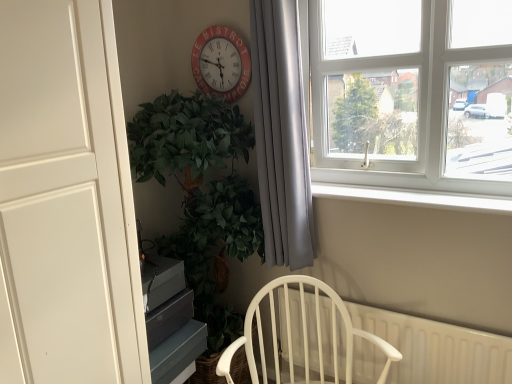
What do you see at coordinates (221, 63) in the screenshot? The image size is (512, 384). I see `matte red clock at upper center` at bounding box center [221, 63].

What do you see at coordinates (303, 336) in the screenshot? The height and width of the screenshot is (384, 512). I see `white wood chair at lower center` at bounding box center [303, 336].

The width and height of the screenshot is (512, 384). I want to click on green leafy plant at left, so click(x=202, y=197).

Find the location of a particular element. silky gray curtain at center is located at coordinates (x=281, y=135).

Where is `matte red clock at upper center`? matte red clock at upper center is located at coordinates (221, 63).

Between point (221, 220) and point (331, 195), which one is positioned behind?

The point (331, 195) is behind.

Is green leafy plant at left inside or outside of white smooth window sill at upper right?

green leafy plant at left is located beyond the bounds of white smooth window sill at upper right.

Is green leafy plant at left positioned with its back to white smooth window sill at upper right?

No, green leafy plant at left's orientation is not away from white smooth window sill at upper right.

Does green leafy plant at left have a greater height compared to white smooth window sill at upper right?

Yes, green leafy plant at left is taller than white smooth window sill at upper right.

Would you say white plastic window at upper right is inside or outside green leafy plant at left?

white plastic window at upper right exists outside the volume of green leafy plant at left.

Considering the positions of objects white plastic window at upper right and green leafy plant at left in the image provided, who is behind, white plastic window at upper right or green leafy plant at left?

green leafy plant at left.

Considering the relative positions of white plastic window at upper right and green leafy plant at left in the image provided, is white plastic window at upper right to the left or to the right of green leafy plant at left?

white plastic window at upper right is to the right of green leafy plant at left.

From the image's perspective, is white plastic window at upper right located beneath green leafy plant at left?

No.

Does matte red clock at upper center lie in front of white plastic radiator at lower right?

No, the depth of matte red clock at upper center is greater than that of white plastic radiator at lower right.

From the image's perspective, would you say matte red clock at upper center is positioned over white plastic radiator at lower right?

Yes, from the image's perspective, matte red clock at upper center is over white plastic radiator at lower right.

Who is smaller, matte red clock at upper center or white plastic radiator at lower right?

matte red clock at upper center is smaller.

Which is in front, point (229, 72) or point (495, 368)?

The point (495, 368) is closer.

Is point (50, 304) positioned in front of point (258, 126)?

Yes, it is in front of point (258, 126).

Can you confirm if white matte door at left is positioned to the left of silky gray curtain at center?

Correct, you'll find white matte door at left to the left of silky gray curtain at center.

From the image's perspective, relative to silky gray curtain at center, is white matte door at left above or below?

From the image's perspective, white matte door at left appears below silky gray curtain at center.

Considering the relative sizes of silky gray curtain at center and white matte door at left in the image provided, is silky gray curtain at center thinner than white matte door at left?

Indeed, silky gray curtain at center has a lesser width compared to white matte door at left.

Does silky gray curtain at center lie in front of white matte door at left?

No, it is not.

From a real-world perspective, which is physically below, silky gray curtain at center or white matte door at left?

white matte door at left is physically lower.

Is silky gray curtain at center far from white matte door at left?

Actually, silky gray curtain at center and white matte door at left are a little close together.

The height and width of the screenshot is (384, 512). I want to click on chair that appears in front of the white plastic window at upper right, so click(x=303, y=336).

Which object is wider, white plastic window at upper right or white wood chair at lower center?

white wood chair at lower center.

Considering the sizes of objects white plastic window at upper right and white wood chair at lower center in the image provided, who is shorter, white plastic window at upper right or white wood chair at lower center?

white wood chair at lower center is shorter.

Based on their sizes in the image, would you say white plastic window at upper right is bigger or smaller than white smooth window sill at upper right?

white plastic window at upper right is bigger than white smooth window sill at upper right.

Is point (390, 168) closer to viewer compared to point (317, 194)?

Yes.

Image resolution: width=512 pixels, height=384 pixels. In the image, there is a white smooth window sill at upper right. Find the location of `window above it (from the image's perspective)`. window above it (from the image's perspective) is located at coordinates (418, 111).

Find the location of a particular element. This screenshot has height=384, width=512. window sill that appears above the green leafy plant at left (from a real-world perspective) is located at coordinates (414, 197).

You are a GUI agent. You are given a task and a screenshot of the screen. Output one action in this format:
    pyautogui.click(x=<x>, y=<y>)
    Task: Click on the houseplant that appears below the white plastic window at upper right (from the image's perspective)
    The image size is (512, 384).
    Given the screenshot: What is the action you would take?
    pyautogui.click(x=202, y=197)

Which object lies further to the anchor point white smooth window sill at upper right, white wood chair at lower center or white plastic radiator at lower right?

Among the two, white wood chair at lower center is located further to white smooth window sill at upper right.

Estimate the real-world distances between objects in this image. Which object is further from green leafy plant at left, white plastic radiator at lower right or white plastic window at upper right?

Among the two, white plastic window at upper right is located further to green leafy plant at left.

From the image, which object appears to be farther from silky gray curtain at center, white smooth window sill at upper right or white wood chair at lower center?

white wood chair at lower center.

Estimate the real-world distances between objects in this image. Which object is closer to white smooth window sill at upper right, white plastic window at upper right or silky gray curtain at center?

The object closer to white smooth window sill at upper right is white plastic window at upper right.

From the image, which object appears to be nearer to white plastic radiator at lower right, white plastic window at upper right or white wood chair at lower center?

The object closer to white plastic radiator at lower right is white wood chair at lower center.

Considering their positions, is matte red clock at upper center positioned further to white plastic window at upper right than white matte door at left?

Based on the image, white matte door at left appears to be further to white plastic window at upper right.

Based on the photo, looking at the image, which one is located closer to white wood chair at lower center, silky gray curtain at center or matte red clock at upper center?

silky gray curtain at center.

When comparing their distances from white plastic radiator at lower right, does green leafy plant at left or white wood chair at lower center seem closer?

The object closer to white plastic radiator at lower right is white wood chair at lower center.

Locate an element on the screen. This screenshot has height=384, width=512. curtain between matte red clock at upper center and white plastic radiator at lower right in the vertical direction is located at coordinates (281, 135).

You are a GUI agent. You are given a task and a screenshot of the screen. Output one action in this format:
    pyautogui.click(x=<x>, y=<y>)
    Task: Click on the curtain situated between white matte door at left and white smooth window sill at upper right from left to right
    The height and width of the screenshot is (384, 512).
    Given the screenshot: What is the action you would take?
    pyautogui.click(x=281, y=135)

Where is `houseplant between silky gray curtain at center and white wood chair at lower center in the vertical direction`? The height and width of the screenshot is (384, 512). houseplant between silky gray curtain at center and white wood chair at lower center in the vertical direction is located at coordinates (202, 197).

In order to click on curtain situated between white matte door at left and white plastic radiator at lower right from left to right in this screenshot , I will do `click(281, 135)`.